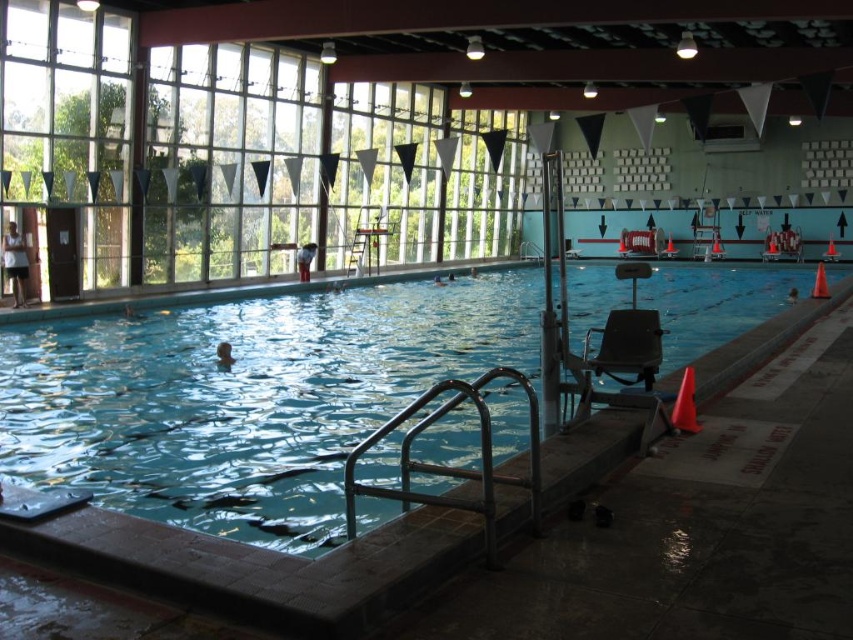
You are a swimmer who wants to place a white cotton shirt on the pool deck. The pool deck has a black chair at the right edge. Can you tell me if the white cotton shirt at left is taller than the smooth skin person at right?

The white cotton shirt at left is taller than the smooth skin person at right, so yes, it is taller.

You are a photographer standing at the poolside. You want to take a photo that includes both the white cotton shirt at left and the smooth skin person at right. Which object should you focus on first if you want to ensure both are in sharp focus?

The white cotton shirt at left is larger in size than the smooth skin person at right, so you should focus on the white cotton shirt at left first to ensure both are in sharp focus.